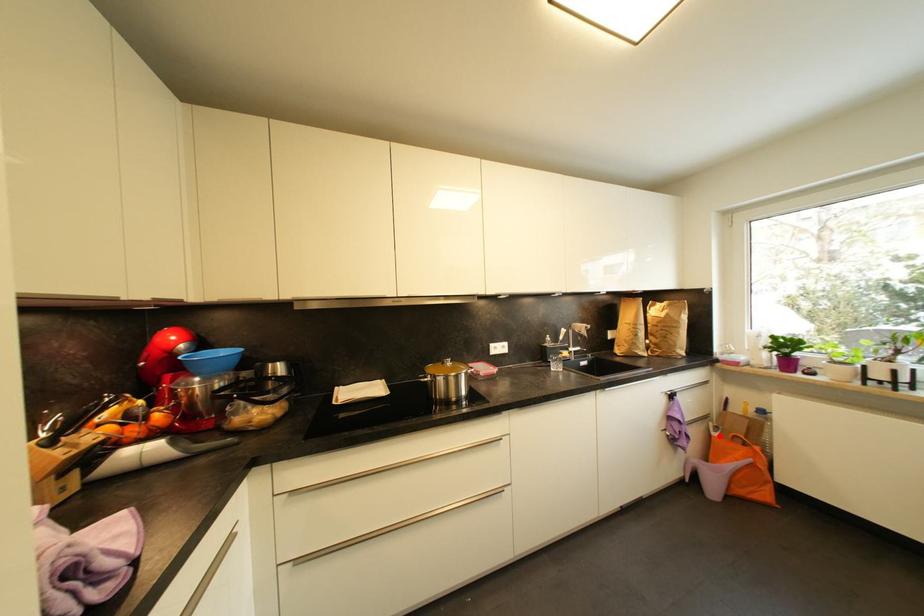
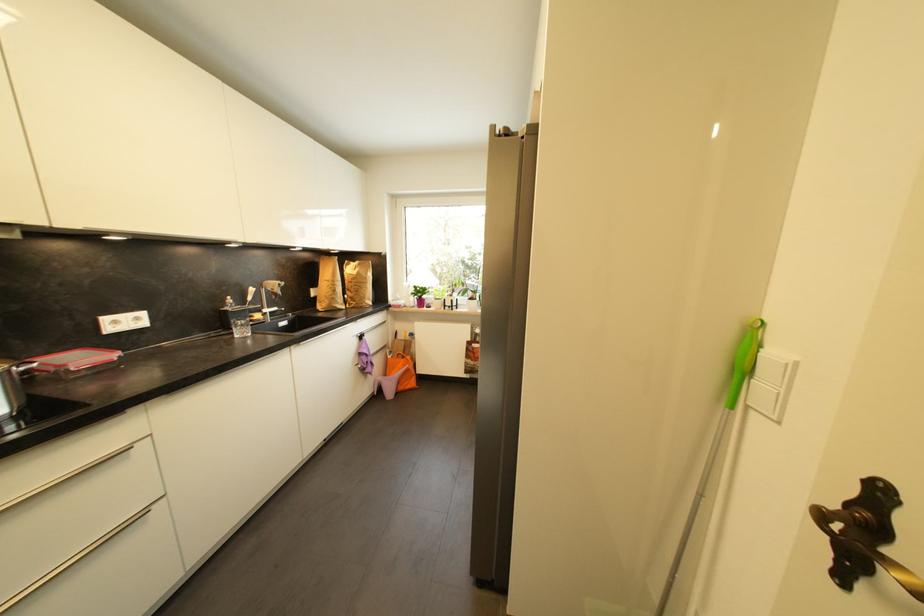
The point at the highlighted location is marked in the first image. Where is the corresponding point in the second image?

(395, 359)